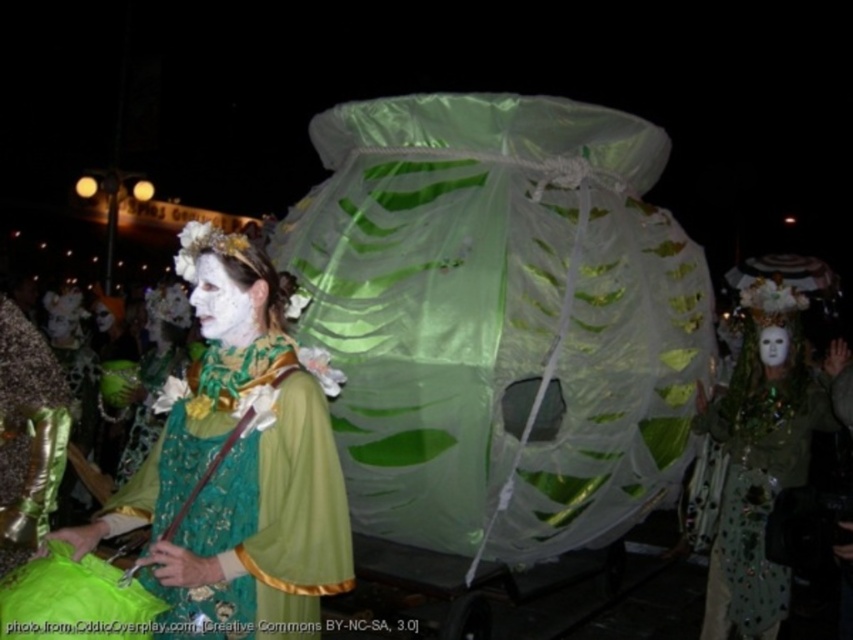
Can you confirm if green lace dress at center is bigger than white matte face at center?

Indeed, green lace dress at center has a larger size compared to white matte face at center.

Can you confirm if green lace dress at center is wider than white matte face at center?

Yes.

At what (x,y) coordinates should I click in order to perform the action: click on green lace dress at center. Please return your answer as a coordinate pair (x, y). Looking at the image, I should click on (239, 480).

Between point (772, 608) and point (761, 332), which one is positioned in front?

Point (772, 608) is more forward.

Who is positioned more to the left, green sequined mask at center or white matte mask at center?

green sequined mask at center is more to the left.

Which is in front, point (712, 579) or point (784, 339)?

Point (712, 579)

The width and height of the screenshot is (853, 640). In order to click on green sequined mask at center in this screenshot , I will do `click(757, 508)`.

Who is shorter, green lace dress at center or white matte mask at center?

With less height is white matte mask at center.

What do you see at coordinates (239, 480) in the screenshot?
I see `green lace dress at center` at bounding box center [239, 480].

Find the location of a particular element. The image size is (853, 640). green lace dress at center is located at coordinates (239, 480).